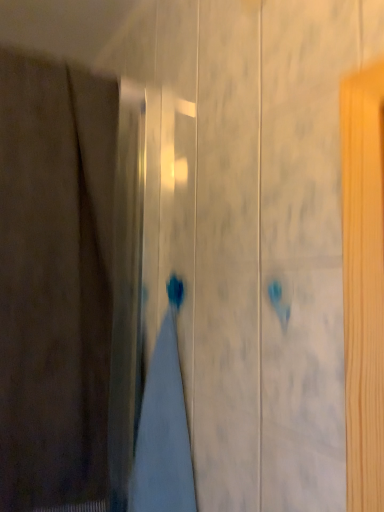
Question: Is point (4, 313) closer or farther from the camera than point (139, 479)?

Choices:
 (A) farther
 (B) closer

Answer: (B)

Question: Is brown fabric curtain at left taller or shorter than gray cotton bath towel at center?

Choices:
 (A) short
 (B) tall

Answer: (B)

Question: Considering the positions of brown fabric curtain at left and gray cotton bath towel at center in the image, is brown fabric curtain at left wider or thinner than gray cotton bath towel at center?

Choices:
 (A) thin
 (B) wide

Answer: (B)

Question: Does point (160, 462) appear closer or farther from the camera than point (16, 154)?

Choices:
 (A) closer
 (B) farther

Answer: (A)

Question: Is gray cotton bath towel at center taller or shorter than brown fabric curtain at left?

Choices:
 (A) tall
 (B) short

Answer: (B)

Question: From the image's perspective, is gray cotton bath towel at center located above or below brown fabric curtain at left?

Choices:
 (A) below
 (B) above

Answer: (A)

Question: Considering their positions, is gray cotton bath towel at center located in front of or behind brown fabric curtain at left?

Choices:
 (A) behind
 (B) front

Answer: (A)